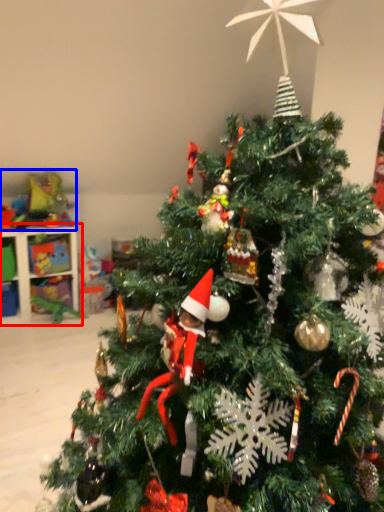
Question: Which object appears farthest to the camera in this image, shelf (highlighted by a red box) or toy (highlighted by a blue box)?

Choices:
 (A) shelf
 (B) toy

Answer: (B)